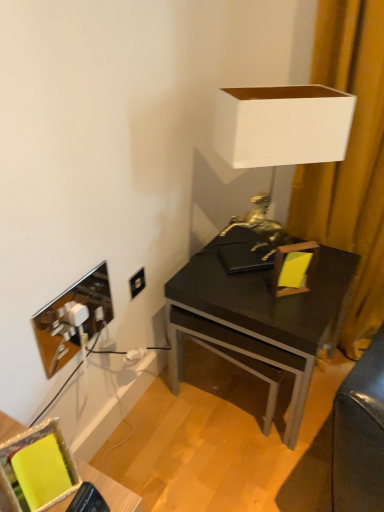
This screenshot has height=512, width=384. Identify the location of free point in front of white matte lampshade at upper right. (278, 303).